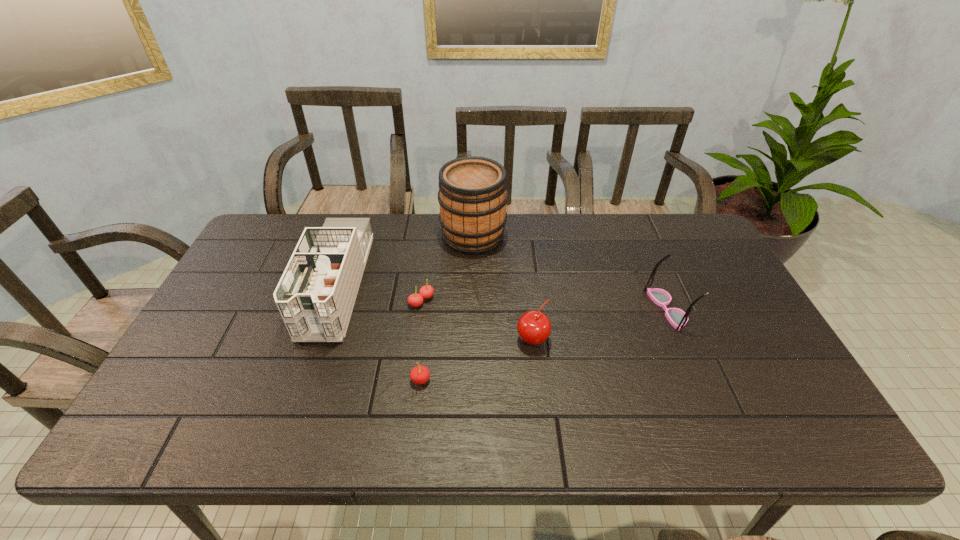
The image size is (960, 540). I want to click on free space at the left edge of the desktop, so click(198, 381).

Find the location of a particular element. vacant space at the right edge of the desktop is located at coordinates (716, 285).

Locate an element on the screen. The width and height of the screenshot is (960, 540). vacant space at the far right corner of the desktop is located at coordinates (677, 219).

Locate an element on the screen. This screenshot has height=540, width=960. blank region between the shortest object and the tallest cherry is located at coordinates coord(477,320).

The height and width of the screenshot is (540, 960). In order to click on free space between the leftmost object and the shortest cherry in this screenshot , I will do `click(379, 293)`.

Find the location of `empty location between the rightmost object and the second nearest cherry`. empty location between the rightmost object and the second nearest cherry is located at coordinates (599, 324).

The image size is (960, 540). Identify the location of vacant area between the shortest cherry and the third shortest object. (477, 320).

Locate an element on the screen. This screenshot has height=540, width=960. free space between the fifth shortest object and the cider is located at coordinates (405, 260).

The image size is (960, 540). Find the location of `vacant space in between the dollhouse and the cider`. vacant space in between the dollhouse and the cider is located at coordinates (405, 260).

In order to click on unoccupied area between the second shortest cherry and the rightmost object in this screenshot , I will do (543, 345).